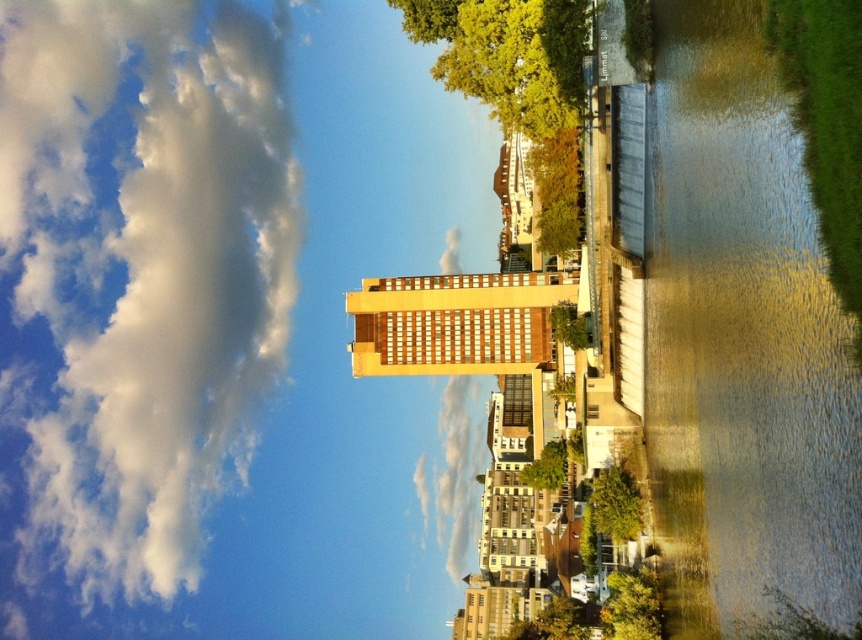
Is white fluffy cloud at upper left in front of green leafy tree at lower center?

No.

Is white fluffy cloud at upper left below green leafy tree at lower center?

Incorrect, white fluffy cloud at upper left is not positioned below green leafy tree at lower center.

The width and height of the screenshot is (862, 640). In order to click on white fluffy cloud at upper left in this screenshot , I will do `click(147, 269)`.

The width and height of the screenshot is (862, 640). Identify the location of white fluffy cloud at upper left. (147, 269).

Locate an element on the screen. This screenshot has width=862, height=640. white fluffy cloud at upper left is located at coordinates (147, 269).

Between white fluffy cloud at center and green leafy tree at lower right, which one is positioned lower?

green leafy tree at lower right is below.

Which is behind, point (479, 460) or point (644, 570)?

Point (479, 460)

I want to click on white fluffy cloud at center, so click(457, 468).